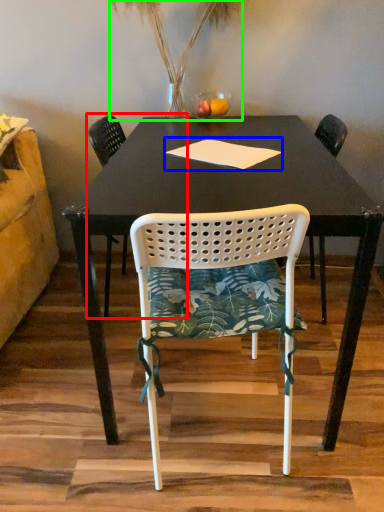
Question: Estimate the real-world distances between objects in this image. Which object is closer to chair (highlighted by a red box), notepad (highlighted by a blue box) or plant (highlighted by a green box)?

Choices:
 (A) notepad
 (B) plant

Answer: (B)